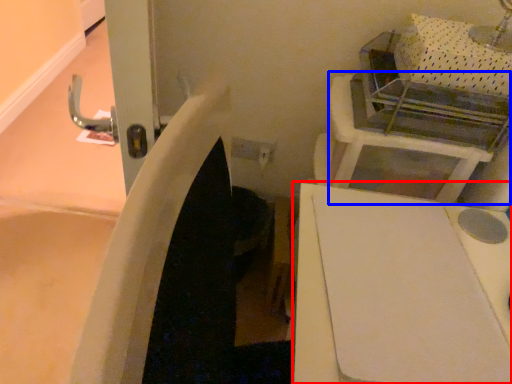
Question: Which point is further to the camera, furniture (highlighted by a red box) or vanity (highlighted by a blue box)?

Choices:
 (A) furniture
 (B) vanity

Answer: (B)